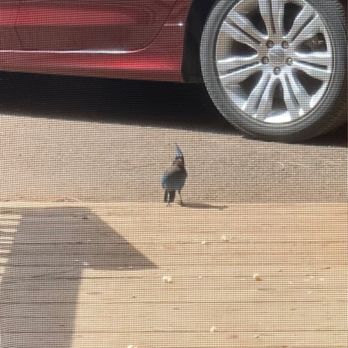
The height and width of the screenshot is (348, 348). What are the coordinates of `wooden boards` in the screenshot? It's located at (130, 311).